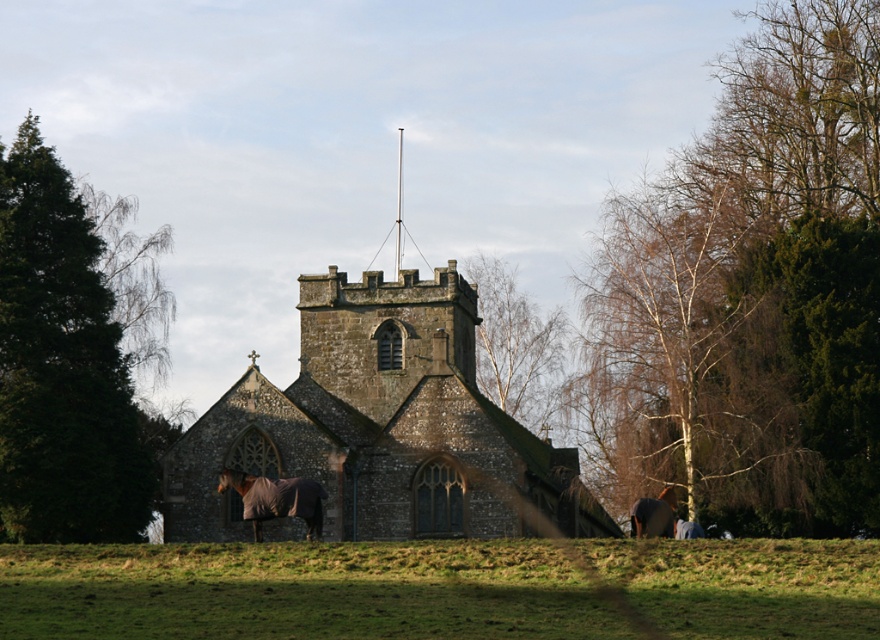
Question: Which object is positioned farthest from the green leafy tree at left?

Choices:
 (A) bare branches at upper right
 (B) brown fuzzy horse at lower right

Answer: (B)

Question: Can you confirm if stone church at center is wider than brown fuzzy horse at lower right?

Choices:
 (A) no
 (B) yes

Answer: (B)

Question: From the image, what is the correct spatial relationship of green grass at lower center in relation to stone church at center?

Choices:
 (A) right
 (B) left

Answer: (B)

Question: Does green leafy tree at left appear on the right side of brown fleece horse at lower left?

Choices:
 (A) yes
 (B) no

Answer: (B)

Question: Which point is farther from the camera taking this photo?

Choices:
 (A) (423, 467)
 (B) (335, 545)
 (C) (294, 504)

Answer: (A)

Question: Which point is closer to the camera?

Choices:
 (A) 255,531
 (B) 206,634
 (C) 510,301
 (D) 479,456

Answer: (B)